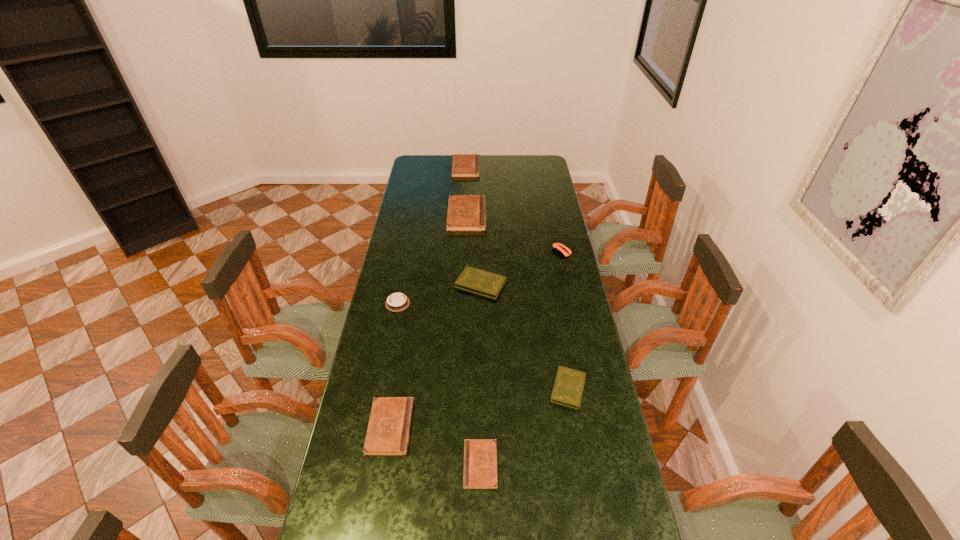
You are a GUI agent. You are given a task and a screenshot of the screen. Output one action in this format:
    pyautogui.click(x=<x>, y=<y>)
    Task: Click on the free location that satisfies the following two spatial constraints: 1. on the front side of the farther green diary; 2. on the spine side of the smallest brown diary
    Image resolution: width=960 pixels, height=540 pixels.
    Given the screenshot: What is the action you would take?
    pyautogui.click(x=482, y=465)

This screenshot has height=540, width=960. Identify the location of free location that satisfies the following two spatial constraints: 1. on the spine side of the biggest brown diary; 2. on the right side of the rightmost diary. (460, 388).

Locate an element on the screen. This screenshot has height=540, width=960. blank space that satisfies the following two spatial constraints: 1. on the spine side of the tallest object; 2. on the left side of the orange computer mouse is located at coordinates (466, 252).